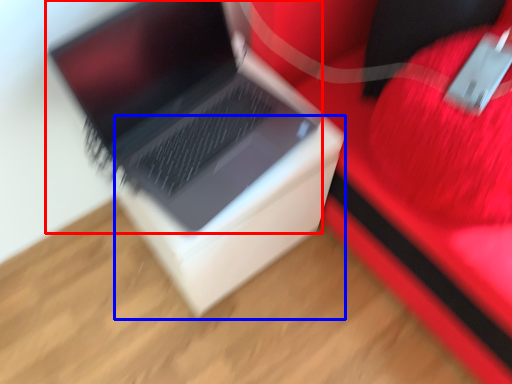
Question: Which of the following is the farthest to the observer, laptop (highlighted by a red box) or cardboard box (highlighted by a blue box)?

Choices:
 (A) laptop
 (B) cardboard box

Answer: (B)